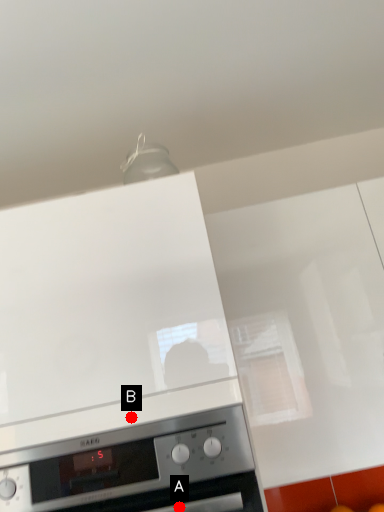
Question: Two points are circled on the image, labeled by A and B beside each circle. Which of the following is the farthest from the observer?

Choices:
 (A) A is further
 (B) B is further

Answer: (B)